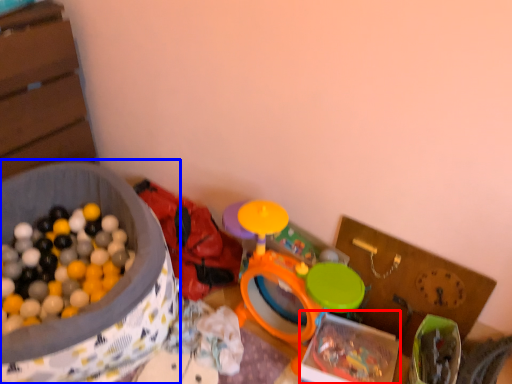
Question: Which object appears closest to the camera in this image, box (highlighted by a red box) or box (highlighted by a blue box)?

Choices:
 (A) box
 (B) box

Answer: (B)